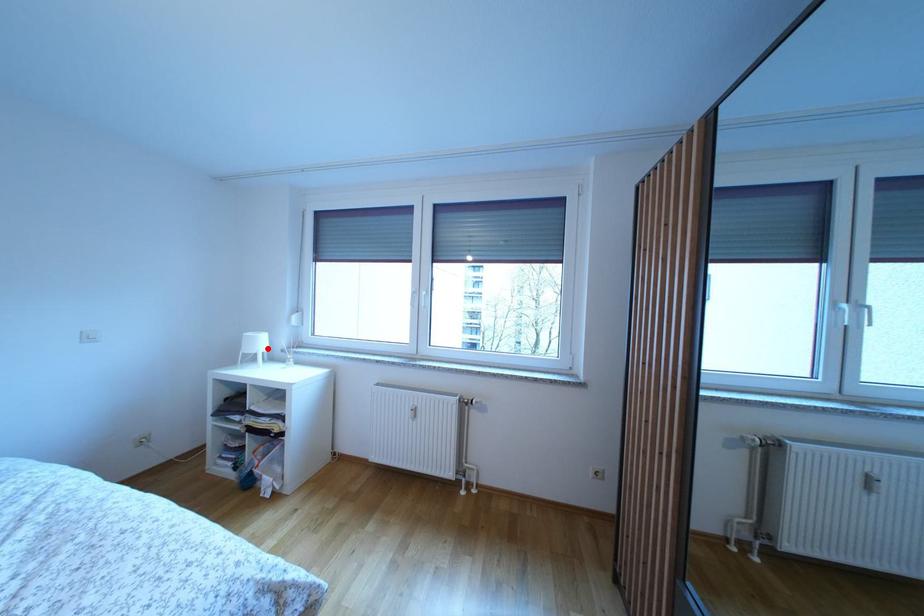
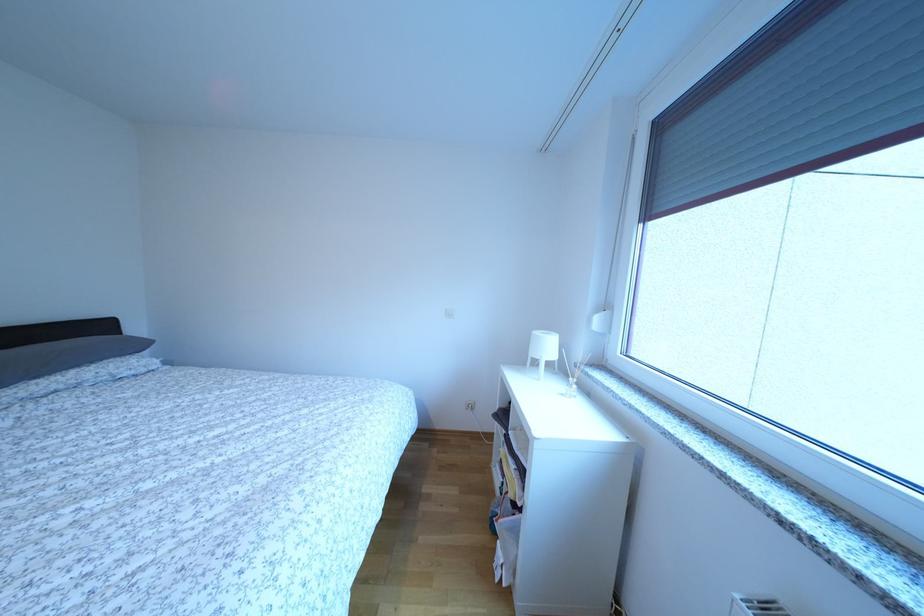
Locate, in the second image, the point that corresponds to the highlighted location in the first image.

(554, 353)